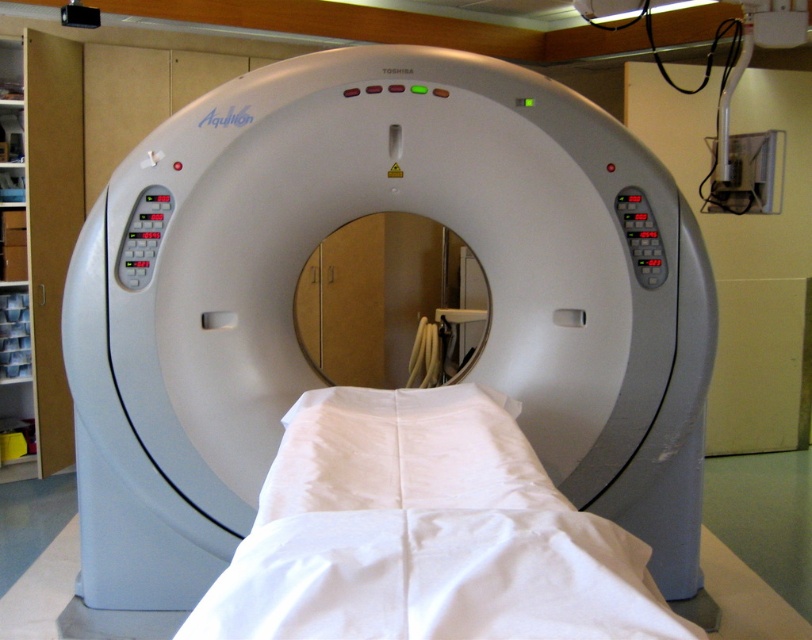
Based on the photo, you are a medical technician preparing to position a patient on the Toshiba Aquilion CT scanner. You have a white fabric bed at center and a white smooth pillow at center. Which object should you adjust first to ensure proper patient alignment for the scan?

The white fabric bed at center should be adjusted first because it is wider than the white smooth pillow at center, ensuring the patient is properly positioned before placing the pillow.

You are a technician standing in front of the Toshiba Aquilion CT scanner. You need to reach both the point at coordinates (603, 582) and the point at (379, 400). Which coordinate point will you reach first?

You will reach the point at (603, 582) first because it is closer to you than the point at (379, 400).

You are a technician preparing to position a patient on the Toshiba Aquilion CT scanner. You need to place the patient on the correct surface. Which object should you use, the white fabric bed at center or the white smooth pillow at center?

You should use the white fabric bed at center because it is positioned to the right of the white smooth pillow at center, making it the appropriate surface for placing the patient on the Toshiba Aquilion CT scanner.